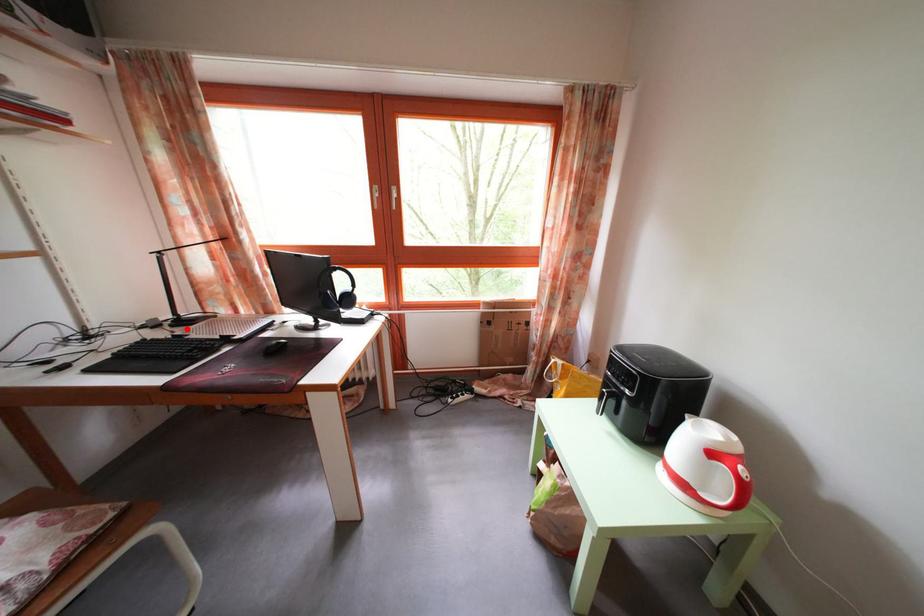
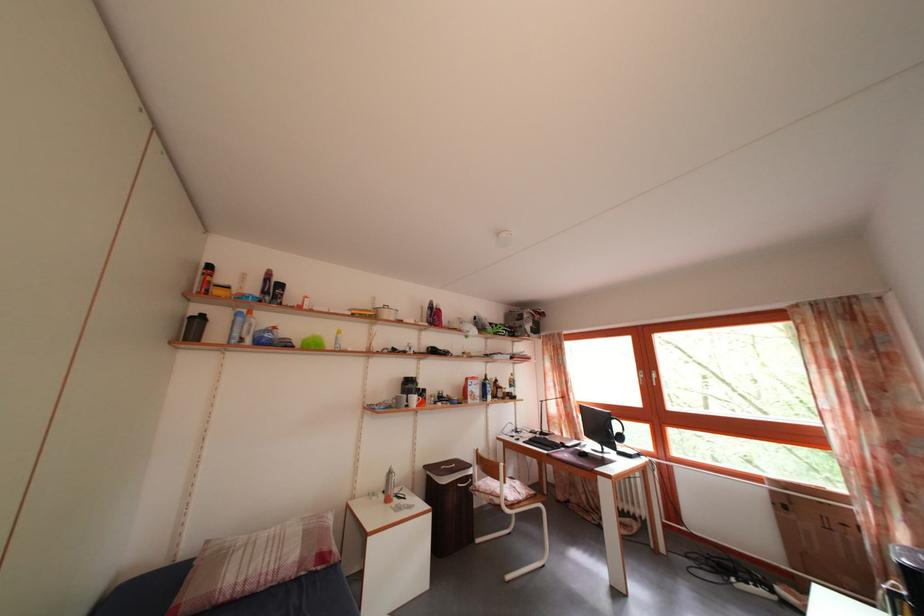
The point at the highlighted location is marked in the first image. Where is the corresponding point in the second image?

(550, 440)